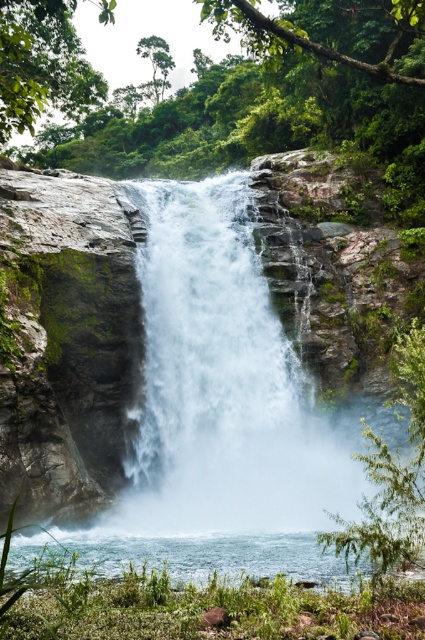
Question: Which point appears closest to the camera in this image?

Choices:
 (A) (164, 534)
 (B) (53, 545)

Answer: (B)

Question: Can you confirm if white misty water at center is bigger than clear water at lower center?

Choices:
 (A) no
 (B) yes

Answer: (B)

Question: Is white misty water at center thinner than clear water at lower center?

Choices:
 (A) yes
 (B) no

Answer: (B)

Question: Where is white misty water at center located in relation to clear water at lower center in the image?

Choices:
 (A) right
 (B) left

Answer: (A)